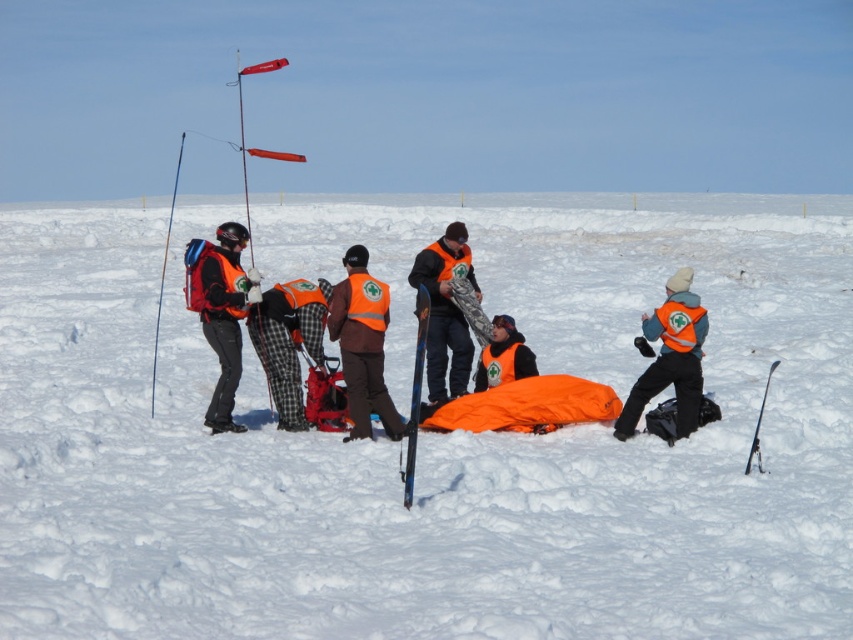
You are a drone operator trying to capture a clear image of the rescue operation. You have two points marked on your screen, point 1 at coordinates point (635, 317) and point 2 at coordinates point (373, 301). Which point should you focus on to ensure it appears closer to the camera in the final image?

Point (635, 317) is further to the camera than point (373, 301), so focusing on point (635, 317) will make it appear closer to the camera in the final image.

You are a rescue worker trying to determine the order of assistance for two individuals in the scene. You see a brown fabric jacket at center and a matte orange vest at center. Which individual should you assist first based on their proximity to you?

The brown fabric jacket at center is closer to the viewer than the matte orange vest at center, so you should assist the individual wearing the brown fabric jacket at center first.

You are a hiker who has spotted two orange vests in the snowy landscape. The first is the matte orange vest at left, and the second is the orange reflective vest at center. Which vest is positioned higher up in the image?

The matte orange vest at left is located above the orange reflective vest at center, so the matte orange vest at left is positioned higher up in the image.